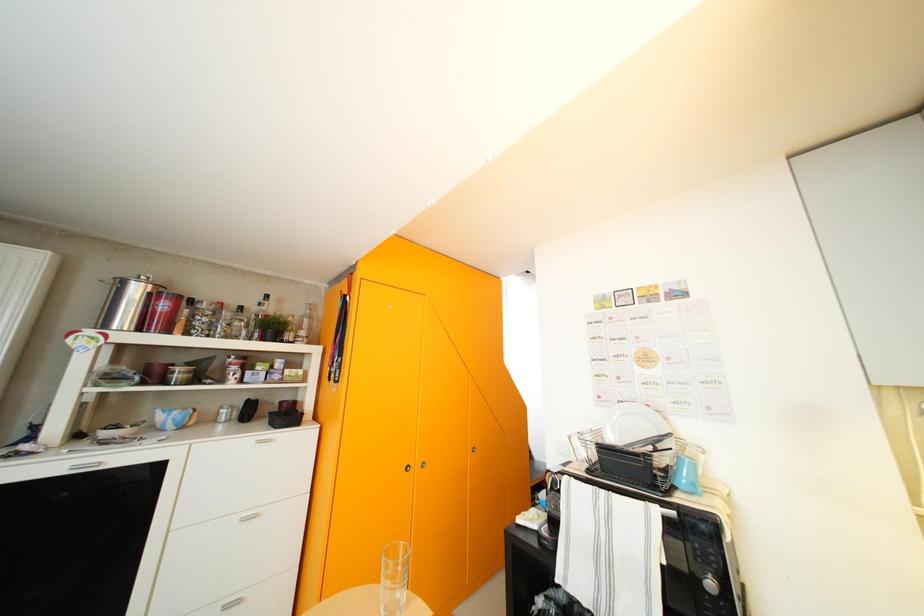
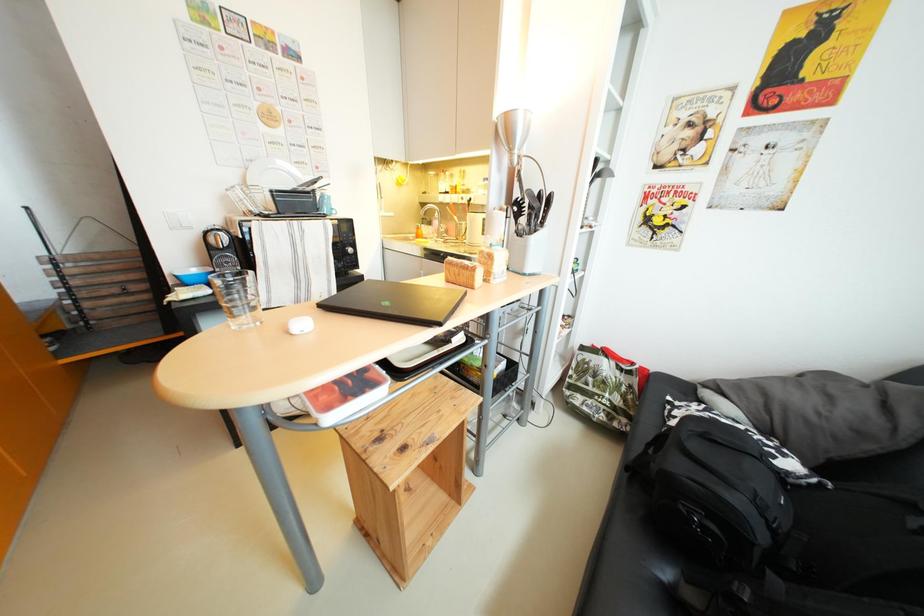
The images are taken continuously from a first-person perspective. In which direction is your viewpoint rotating?

The camera's rotation is toward right-down.